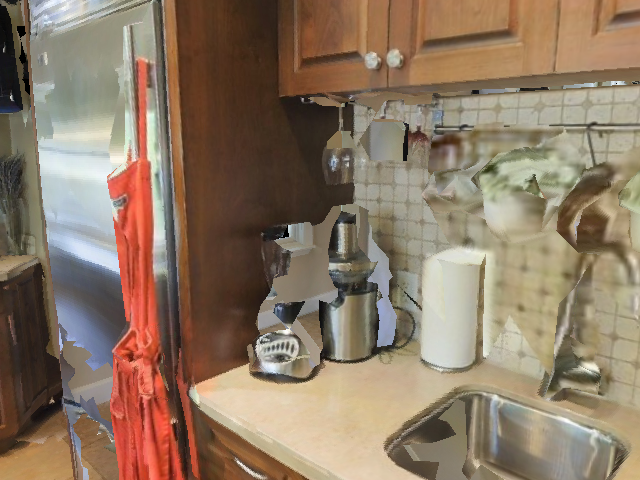
Identify the location of countertops. (305, 422), (8, 262).